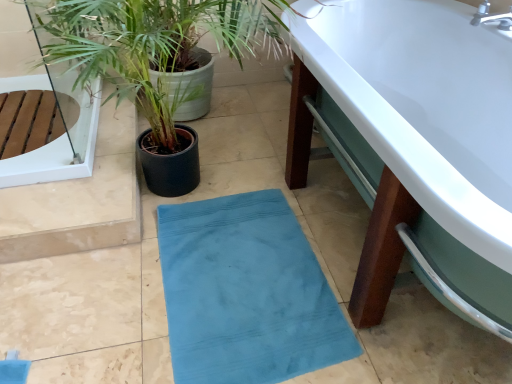
Question: From the image's perspective, is green leafy plant at left under transparent glass door at upper left?

Choices:
 (A) no
 (B) yes

Answer: (B)

Question: Is transparent glass door at upper left a part of green leafy plant at left?

Choices:
 (A) no
 (B) yes

Answer: (A)

Question: Is green leafy plant at left positioned beyond the bounds of transparent glass door at upper left?

Choices:
 (A) yes
 (B) no

Answer: (A)

Question: Is the depth of green leafy plant at left less than that of transparent glass door at upper left?

Choices:
 (A) yes
 (B) no

Answer: (A)

Question: From a real-world perspective, is green leafy plant at left physically above transparent glass door at upper left?

Choices:
 (A) yes
 (B) no

Answer: (A)

Question: Is green leafy plant at left looking in the opposite direction of transparent glass door at upper left?

Choices:
 (A) no
 (B) yes

Answer: (A)

Question: Is teal fabric bath mat at center located outside transparent glass door at upper left?

Choices:
 (A) yes
 (B) no

Answer: (A)

Question: Does teal fabric bath mat at center have a lesser height compared to transparent glass door at upper left?

Choices:
 (A) yes
 (B) no

Answer: (A)

Question: Is teal fabric bath mat at center smaller than transparent glass door at upper left?

Choices:
 (A) yes
 (B) no

Answer: (A)

Question: From the image's perspective, is teal fabric bath mat at center located beneath transparent glass door at upper left?

Choices:
 (A) no
 (B) yes

Answer: (B)

Question: Does teal fabric bath mat at center appear on the right side of transparent glass door at upper left?

Choices:
 (A) yes
 (B) no

Answer: (A)

Question: Does teal fabric bath mat at center have a greater height compared to transparent glass door at upper left?

Choices:
 (A) no
 (B) yes

Answer: (A)

Question: Is green leafy plant at left oriented away from teal fabric bath mat at center?

Choices:
 (A) no
 (B) yes

Answer: (A)